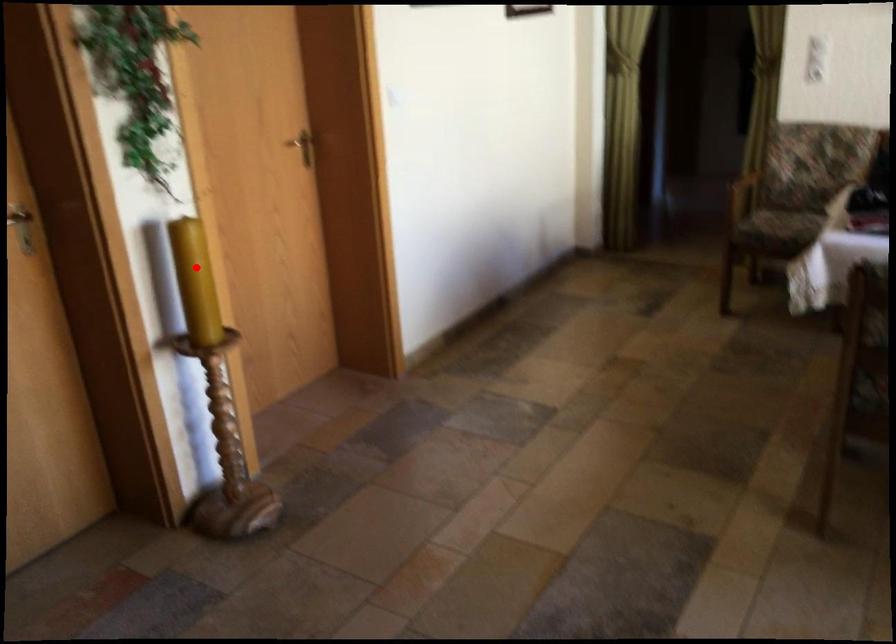
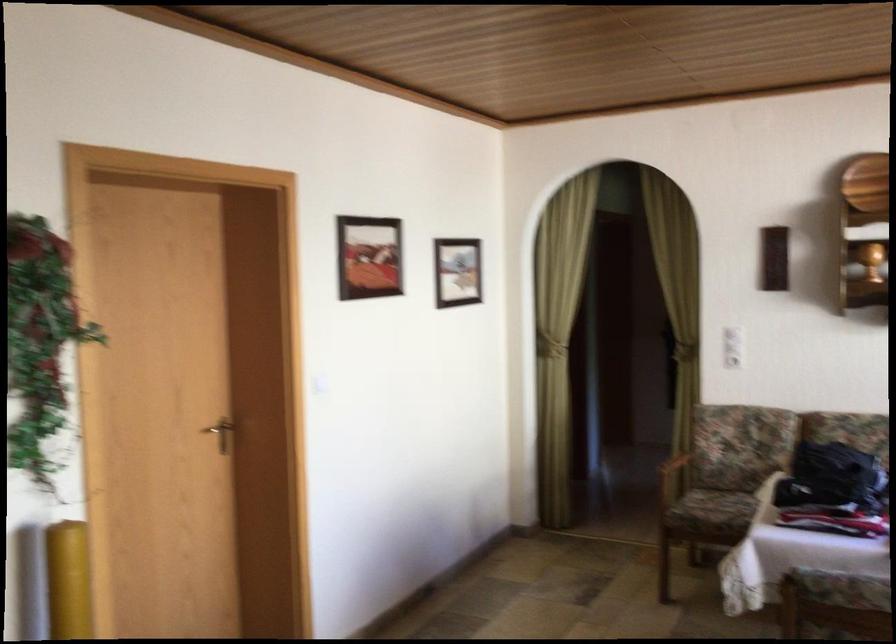
Question: I am providing you with two images of the same scene from different viewpoints. A red point is shown in image1. For the corresponding object point in image2, is it positioned nearer or farther from the camera?

Choices:
 (A) Nearer
 (B) Farther

Answer: (A)